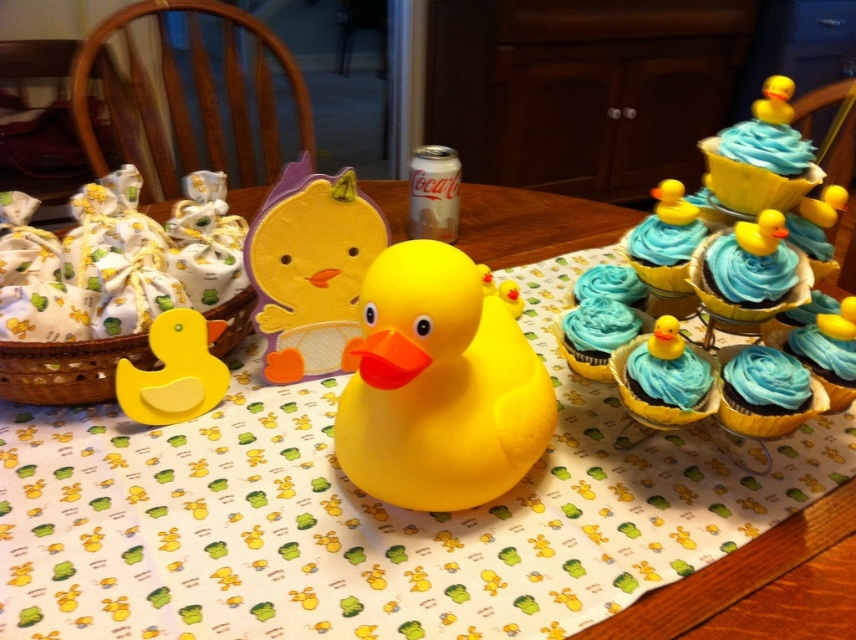
Between blue glossy cupcake at upper right and rubber yellow duck at upper right, which one appears on the right side from the viewer's perspective?

From the viewer's perspective, rubber yellow duck at upper right appears more on the right side.

The image size is (856, 640). What are the coordinates of `blue glossy cupcake at upper right` in the screenshot? It's located at (750, 269).

Who is more distant from viewer, (750, 260) or (782, 100)?

The point (782, 100) is more distant.

The width and height of the screenshot is (856, 640). I want to click on blue glossy cupcake at upper right, so point(750,269).

Which is behind, point (224, 381) or point (724, 244)?

The point (224, 381) is behind.

Is point (159, 417) farther from viewer compared to point (777, 257)?

Yes, point (159, 417) is farther from viewer.

Is point (186, 346) closer to viewer compared to point (746, 284)?

No, (186, 346) is behind (746, 284).

The image size is (856, 640). I want to click on matte yellow rubber duck at lower left, so click(x=174, y=371).

Who is shorter, yellow rubber duck at center or rubber duck at center?

With less height is rubber duck at center.

Can you confirm if yellow rubber duck at center is positioned to the right of rubber duck at center?

In fact, yellow rubber duck at center is to the left of rubber duck at center.

Who is more distant from viewer, [736,508] or [395,435]?

The point [736,508] is behind.

Where is `yellow rubber duck at center`? This screenshot has height=640, width=856. yellow rubber duck at center is located at coordinates (400, 524).